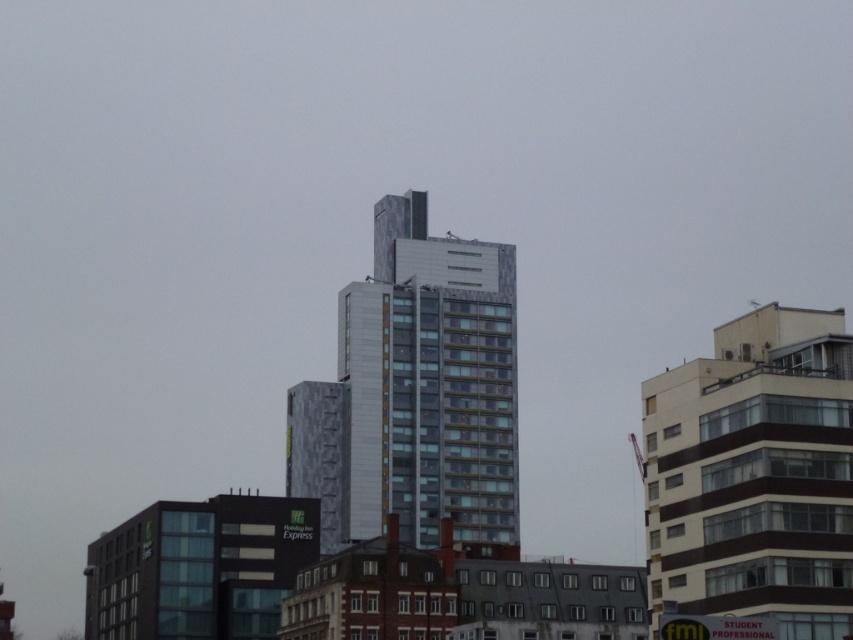
What is the significance of the point at coordinates (415, 392) in the cityscape image?

The point at coordinates (415, 392) indicates the location of the metallic glass building at center.

You are an architect analyzing the city layout. Based on the scene, which building, the metallic glass building at center or the white textured building at right, is closer to the ground?

The metallic glass building at center is positioned under the white textured building at right, meaning it is closer to the ground.

You are standing at the origin point of the city map. You need to locate the metallic glass building at center. What are its coordinates?

The metallic glass building at center is located at coordinates point [415,392].